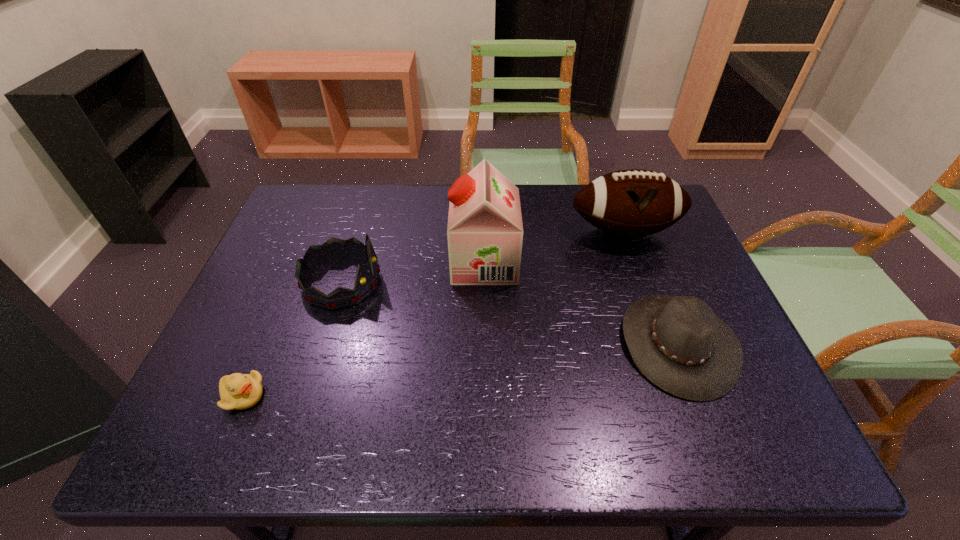
Locate an element on the screen. hat present at the right edge is located at coordinates [x=678, y=343].

What are the coordinates of `object located at the near left corner` in the screenshot? It's located at (238, 391).

Image resolution: width=960 pixels, height=540 pixels. In order to click on object present at the far right corner in this screenshot , I will do `click(630, 203)`.

Where is `free space at the far edge of the desktop`? free space at the far edge of the desktop is located at coordinates point(339,221).

The height and width of the screenshot is (540, 960). What are the coordinates of `free region at the near edge` in the screenshot? It's located at click(319, 450).

In order to click on vacant space at the right edge of the desktop in this screenshot , I will do `click(730, 400)`.

Image resolution: width=960 pixels, height=540 pixels. In the image, there is a desktop. Identify the location of vacant space at the far left corner. click(x=331, y=206).

This screenshot has height=540, width=960. In order to click on empty location between the duckling and the second shortest object in this screenshot , I will do `click(461, 370)`.

The width and height of the screenshot is (960, 540). Find the location of `vacant area that lies between the tallest object and the hat`. vacant area that lies between the tallest object and the hat is located at coordinates (581, 303).

Where is `vacant area that lies between the shortest object and the hat`? vacant area that lies between the shortest object and the hat is located at coordinates (461, 370).